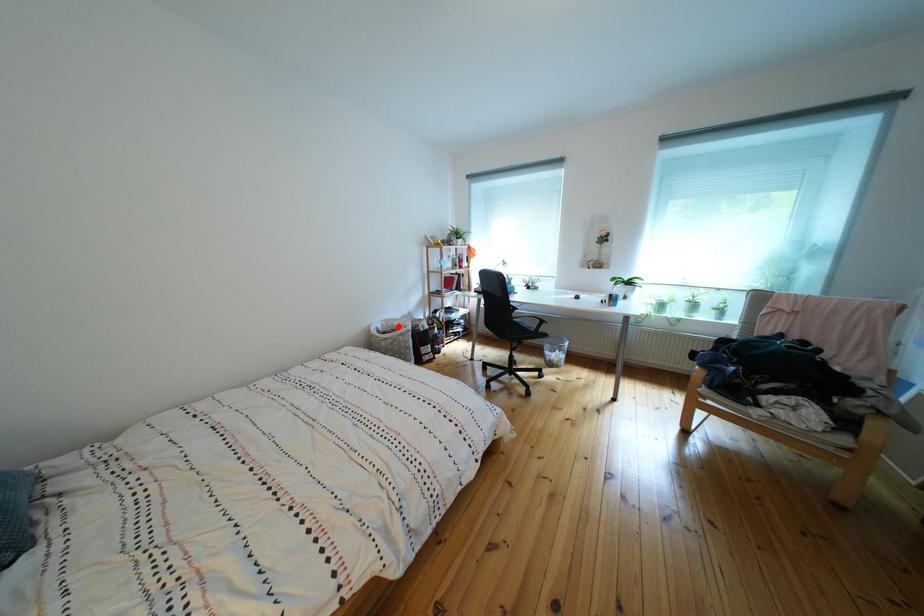
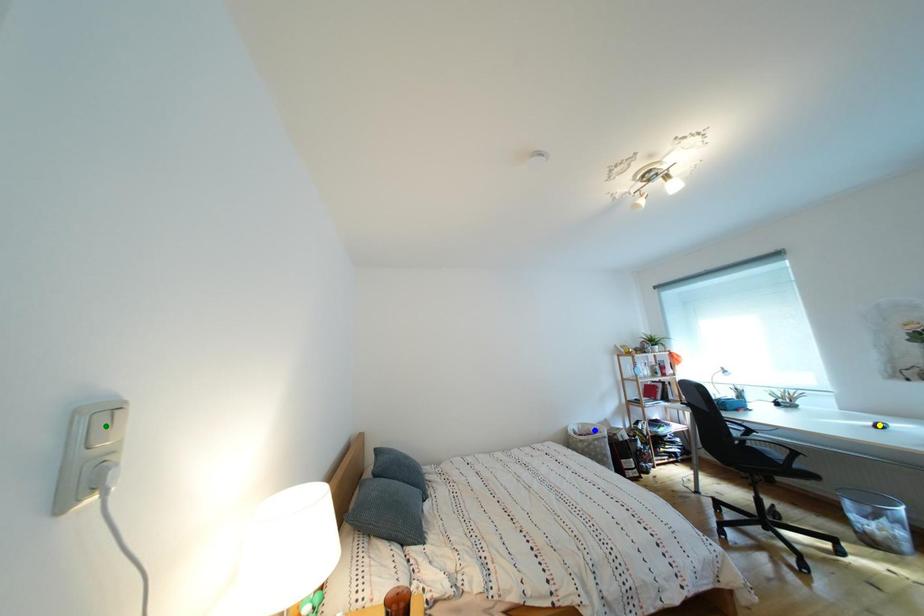
Question: I am providing you with two images of the same scene from different viewpoints. A red point is marked on the first image. You are given multiple points on the second image. In image 2, which mark is for the same physical point as the one in image 1?

Choices:
 (A) green point
 (B) yellow point
 (C) blue point

Answer: (C)